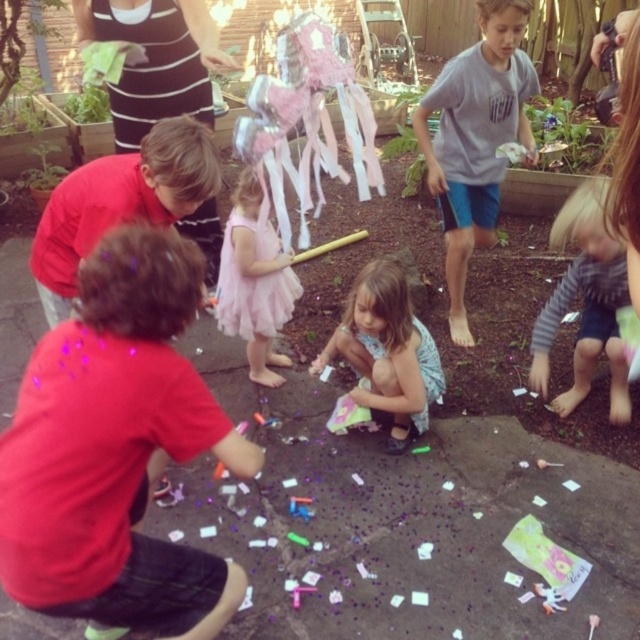
You are a photographer trying to capture a group photo of the children in the scene. You notice the red matte shirt at lower left and the blurred blonde hair at lower right are at different heights. To ensure both are visible in the photo, should you adjust your camera angle upwards or downwards?

The red matte shirt at lower left is shorter than the blurred blonde hair at lower right. To include both in the photo, you should adjust your camera angle downwards to capture the shorter child at lower left and still see the taller blurred blonde hair at lower right.

You are a photographer trying to capture a group photo of the gray cotton shirt at center and the blurred blonde hair at lower right. Since you want both subjects to be in focus, which subject should you focus on to ensure the other is also in focus?

You should focus on the gray cotton shirt at center because it is much taller than the blurred blonde hair at lower right, so focusing on the closer subject might not keep both in focus. Wait, actually, focusing on the farther subject might help. Hmm, maybe I need to think about depth of field. Alternatively, maybe the question is about which one is closer. Since the gray cotton shirt is taller, perhaps it is closer, so focusing on it would include the farther one in the depth of field. But I need to recall